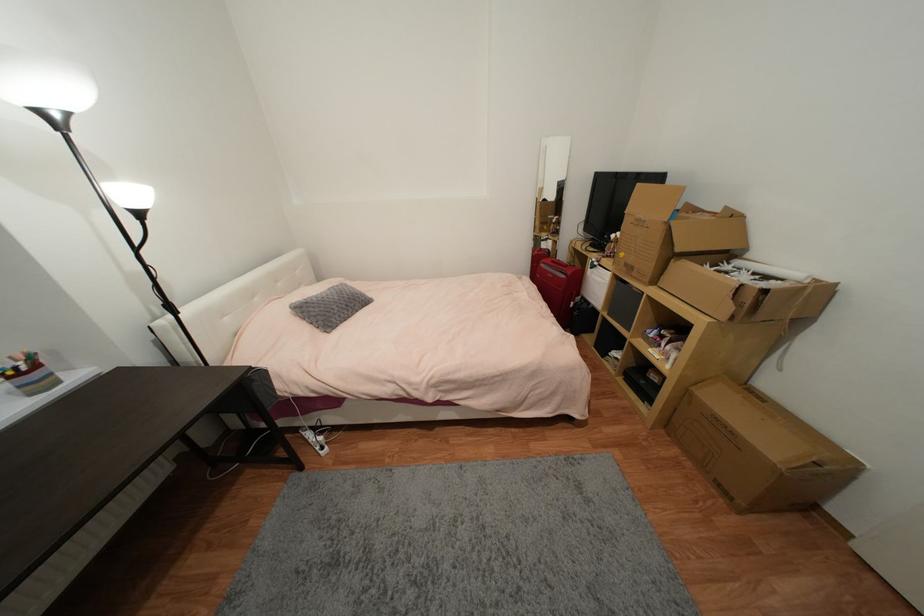
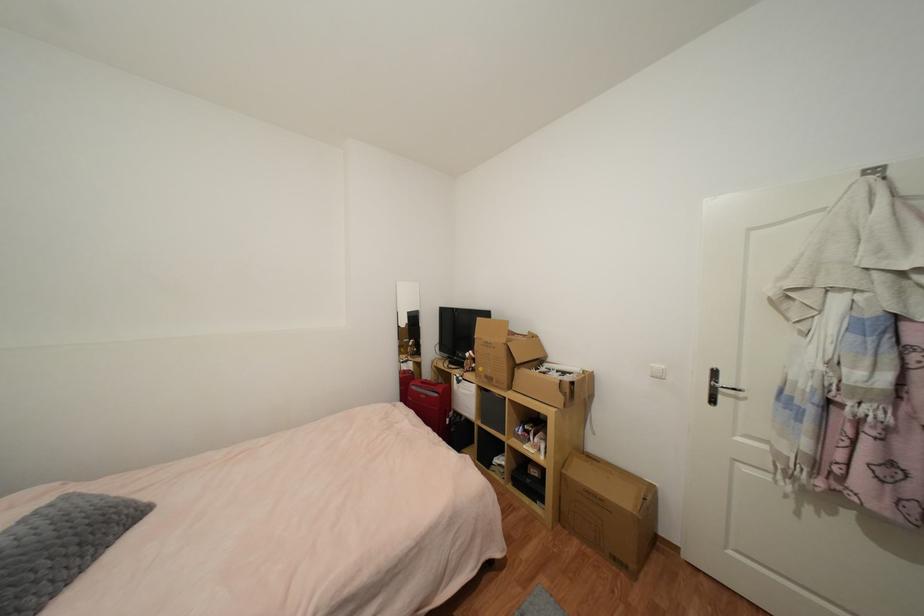
Where in the second image is the point corresponding to pixel 348 308 from the first image?

(79, 551)